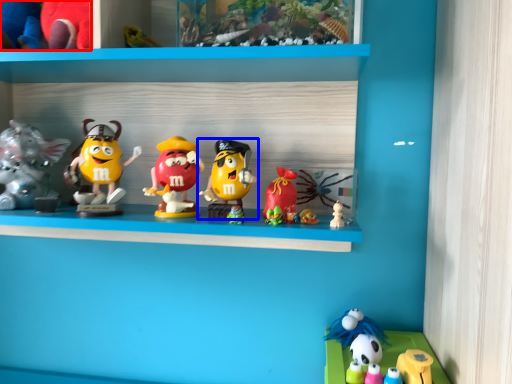
Question: Which object appears closest to the camera in this image, toy (highlighted by a red box) or toy (highlighted by a blue box)?

Choices:
 (A) toy
 (B) toy

Answer: (B)